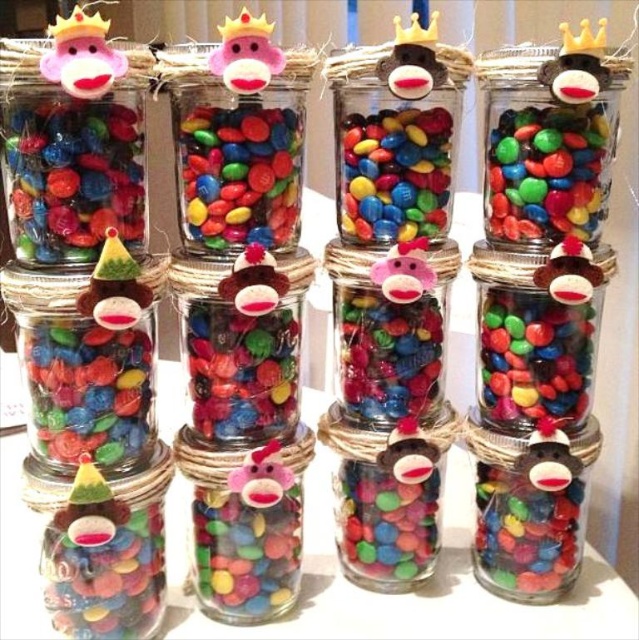
You are organizing a candy display and need to place a rectangular box that is 10 cm wide between the matte plastic candy at center left and the shiny multicolored candies at center right. Based on their widths, will the box fit between them without overlapping?

The matte plastic candy at center left has a lesser width compared to shiny multicolored candies at center right. Since the box is 10 cm wide, it depends on the actual widths of the candies. However, the description only states that the matte candy is narrower, but doesn

You are a child trying to grab candies from the display. If you reach out to the shiny multicolored candies at upper right and the shiny multicolored candies at center right, how far apart are they?

The shiny multicolored candies at upper right and shiny multicolored candies at center right are 6.32 inches apart from each other.